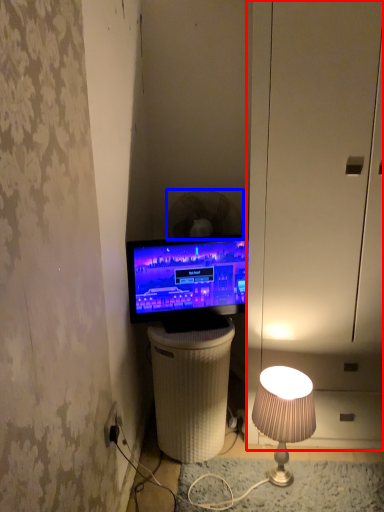
Question: Which point is closer to the camera, dresser (highlighted by a red box) or mechanical fan (highlighted by a blue box)?

Choices:
 (A) dresser
 (B) mechanical fan

Answer: (A)